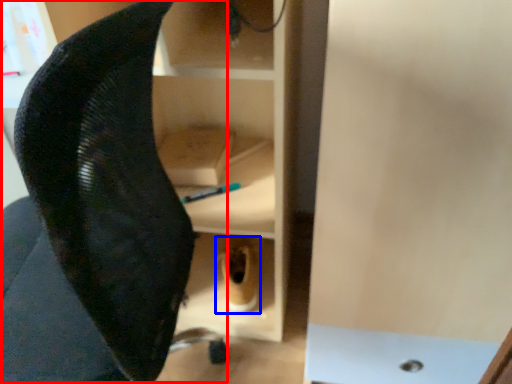
Question: Which object is further to the camera taking this photo, swivel chair (highlighted by a red box) or footwear (highlighted by a blue box)?

Choices:
 (A) swivel chair
 (B) footwear

Answer: (B)